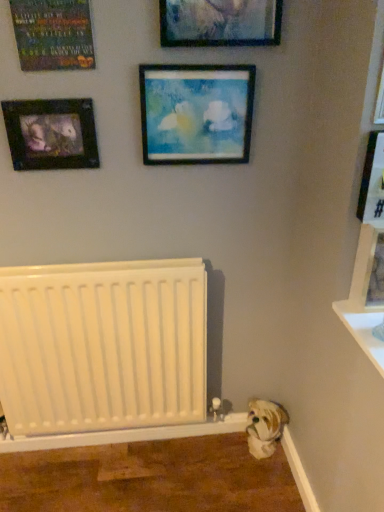
Question: From a real-world perspective, is matte black picture frame at upper left, the first picture frame from the left, physically located above or below matte glass picture frame at upper center, the 4th picture frame from the left?

Choices:
 (A) above
 (B) below

Answer: (B)

Question: From the image's perspective, relative to matte glass picture frame at upper center, the 4th picture frame positioned from the right, is matte black picture frame at upper left, which ranks as the 7th picture frame in right-to-left order, above or below?

Choices:
 (A) above
 (B) below

Answer: (B)

Question: Which object is positioned farthest from the wooden frame at center, marked as the fifth picture frame in a right-to-left arrangement?

Choices:
 (A) wooden picture frame at right, marked as the 2th picture frame in a right-to-left arrangement
 (B) white plush dog at lower right
 (C) metallic silver picture frame at upper right, which appears as the 5th picture frame when viewed from the left
 (D) wooden picture frame at right, acting as the 1th picture frame starting from the right
 (E) white glossy shelf at lower right

Answer: (B)

Question: Estimate the real-world distances between objects in this image. Which object is farther from the white plush dog at lower right?

Choices:
 (A) wooden frame at center, the third picture frame positioned from the left
 (B) matte glass picture frame at upper center, the 4th picture frame from the left
 (C) wooden picture frame at right, the seventh picture frame in the left-to-right sequence
 (D) matte black poster at upper left, the 6th picture frame when ordered from right to left
 (E) wooden picture frame at right, marked as the 2th picture frame in a right-to-left arrangement

Answer: (D)